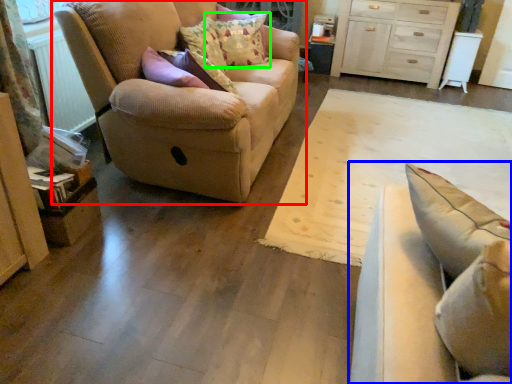
Question: Which object is positioned closest to studio couch (highlighted by a red box)? Select from studio couch (highlighted by a blue box) and pillow (highlighted by a green box).

Choices:
 (A) studio couch
 (B) pillow

Answer: (B)